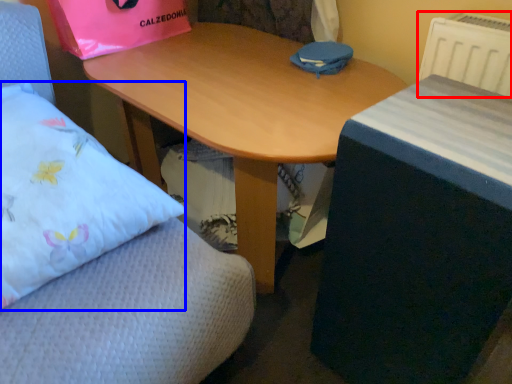
Question: Which of the following is the closest to the observer, radiator (highlighted by a red box) or pillow (highlighted by a blue box)?

Choices:
 (A) radiator
 (B) pillow

Answer: (B)